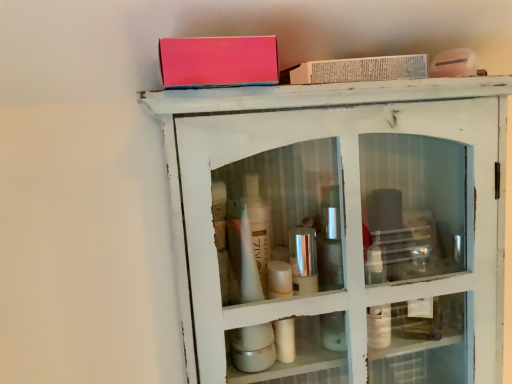
Question: Based on their positions, is matte pink box at upper center, the 2th book viewed from the right, located to the left or right of white distressed cabinet at upper center?

Choices:
 (A) right
 (B) left

Answer: (B)

Question: Considering the positions of point (187, 74) and point (172, 168), is point (187, 74) closer or farther from the camera than point (172, 168)?

Choices:
 (A) closer
 (B) farther

Answer: (A)

Question: Estimate the real-world distances between objects in this image. Which object is closer to the white paper book at upper center, the 1th book viewed from the back?

Choices:
 (A) matte pink box at upper center, the 2th book viewed from the right
 (B) white distressed cabinet at upper center

Answer: (A)

Question: Which object is positioned closest to the matte pink box at upper center, marked as the first book in a left-to-right arrangement?

Choices:
 (A) white distressed cabinet at upper center
 (B) white paper book at upper center, acting as the second book starting from the left

Answer: (B)